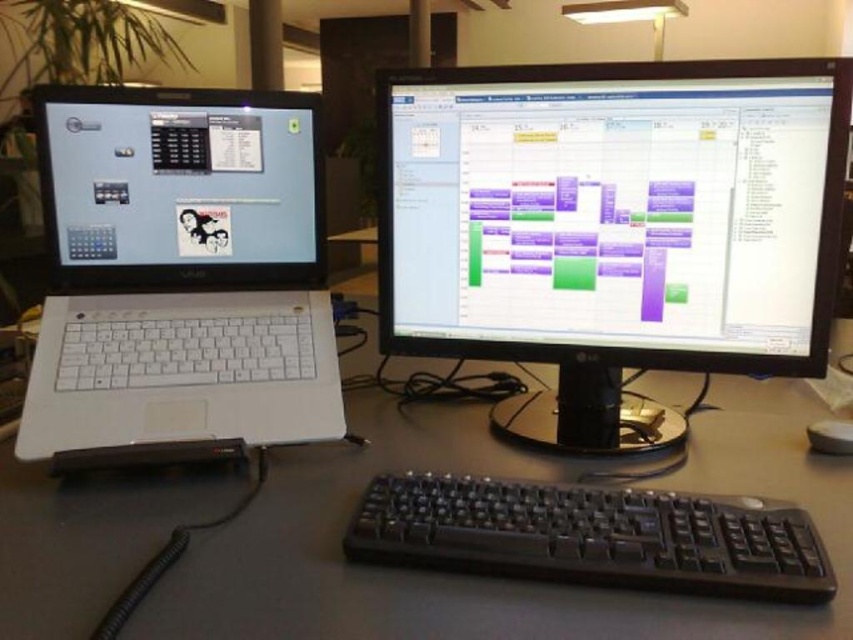
Can you confirm if black plastic keyboard at lower center is taller than black plastic mouse at lower right?

Indeed, black plastic keyboard at lower center has a greater height compared to black plastic mouse at lower right.

What do you see at coordinates (485, 579) in the screenshot?
I see `black plastic keyboard at lower center` at bounding box center [485, 579].

Locate an element on the screen. The height and width of the screenshot is (640, 853). black plastic keyboard at lower center is located at coordinates (485, 579).

Does white plastic laptop at left appear over black plastic mouse at lower right?

Yes.

Can you confirm if white plastic laptop at left is positioned to the left of black plastic mouse at lower right?

Indeed, white plastic laptop at left is positioned on the left side of black plastic mouse at lower right.

Does point (344, 435) come farther from viewer compared to point (828, 424)?

That is False.

Locate an element on the screen. This screenshot has width=853, height=640. white plastic laptop at left is located at coordinates (180, 273).

Which is above, matte black monitor at center or black plastic mouse at lower right?

matte black monitor at center is higher up.

Does point (717, 164) come farther from viewer compared to point (849, 440)?

No, (717, 164) is in front of (849, 440).

This screenshot has height=640, width=853. I want to click on matte black monitor at center, so click(x=612, y=227).